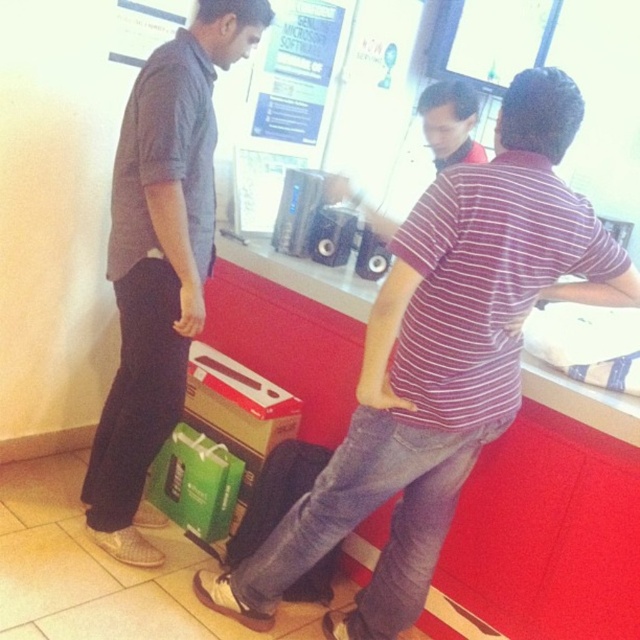
Question: Observing the image, what is the correct spatial positioning of striped cotton shirt at center in reference to dark gray shirt at left?

Choices:
 (A) below
 (B) above

Answer: (A)

Question: Does striped cotton shirt at center have a lesser width compared to dark gray shirt at left?

Choices:
 (A) yes
 (B) no

Answer: (B)

Question: Which point is closer to the camera?

Choices:
 (A) striped cotton shirt at center
 (B) dark gray shirt at left

Answer: (A)

Question: Where is striped cotton shirt at center located in relation to dark gray shirt at left in the image?

Choices:
 (A) below
 (B) above

Answer: (A)